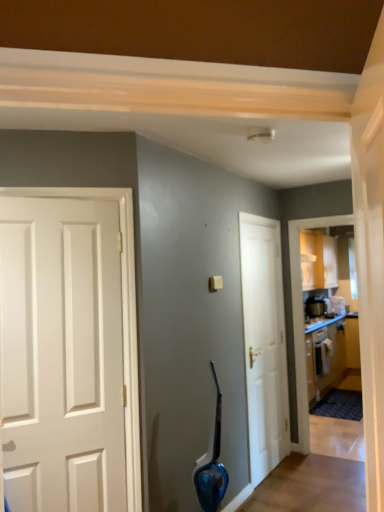
Question: From a real-world perspective, relative to white glossy door at center, is wooden cabinetry at right vertically above or below?

Choices:
 (A) above
 (B) below

Answer: (B)

Question: Which is correct: wooden cabinetry at right is inside white glossy door at center, or outside of it?

Choices:
 (A) outside
 (B) inside

Answer: (A)

Question: Which is farther from the metallic silver toaster at right, which is the 1th appliance in left-to-right order?

Choices:
 (A) metallic silver toaster at upper right, which is the first appliance in right-to-left order
 (B) white glossy door at center
 (C) wooden cabinetry at right

Answer: (B)

Question: Considering the real-world distances, which object is closest to the white glossy door at center?

Choices:
 (A) metallic silver toaster at right, which is the 1th appliance in left-to-right order
 (B) metallic silver toaster at upper right, the second appliance in the left-to-right sequence
 (C) wooden cabinetry at right

Answer: (C)